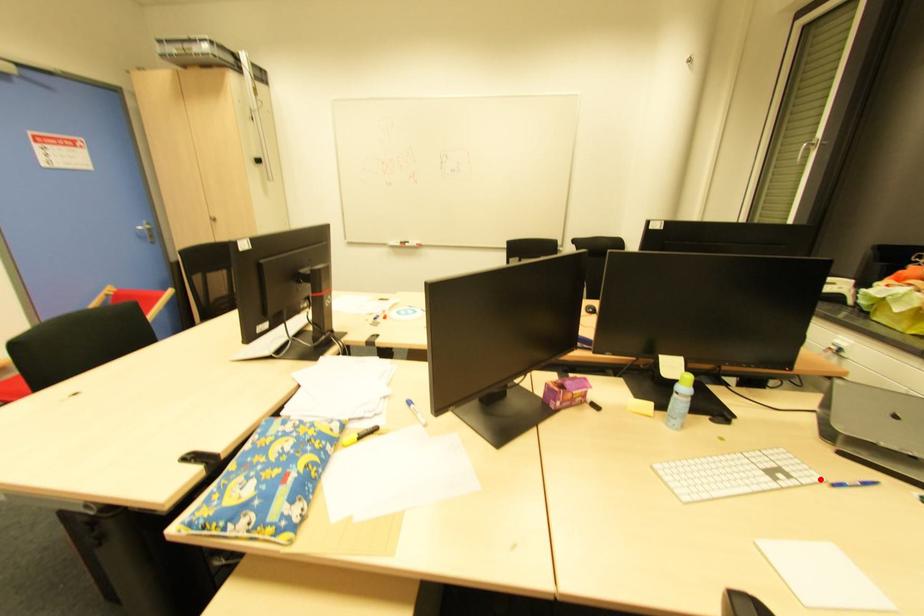
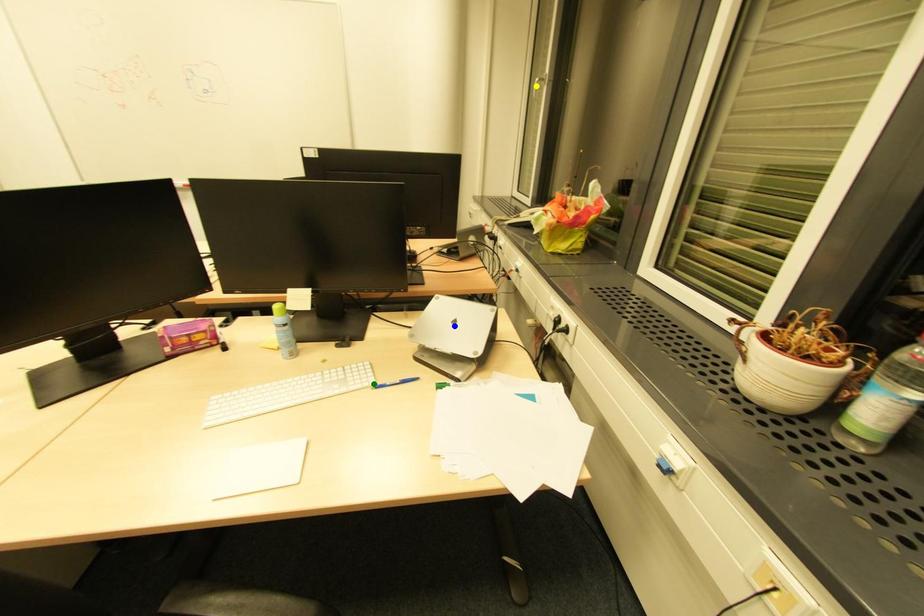
Question: I am providing you with two images of the same scene from different viewpoints. A red point is marked on the first image. You are given multiple points on the second image. Which spot in image 2 lines up with the point in image 1?

Choices:
 (A) blue point
 (B) green point
 (C) yellow point

Answer: (B)